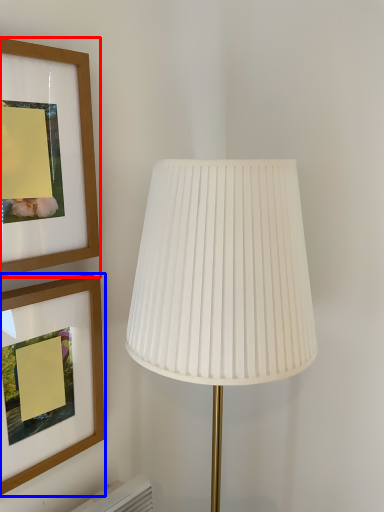
Question: Which point is further to the camera, picture frame (highlighted by a red box) or picture frame (highlighted by a blue box)?

Choices:
 (A) picture frame
 (B) picture frame

Answer: (B)